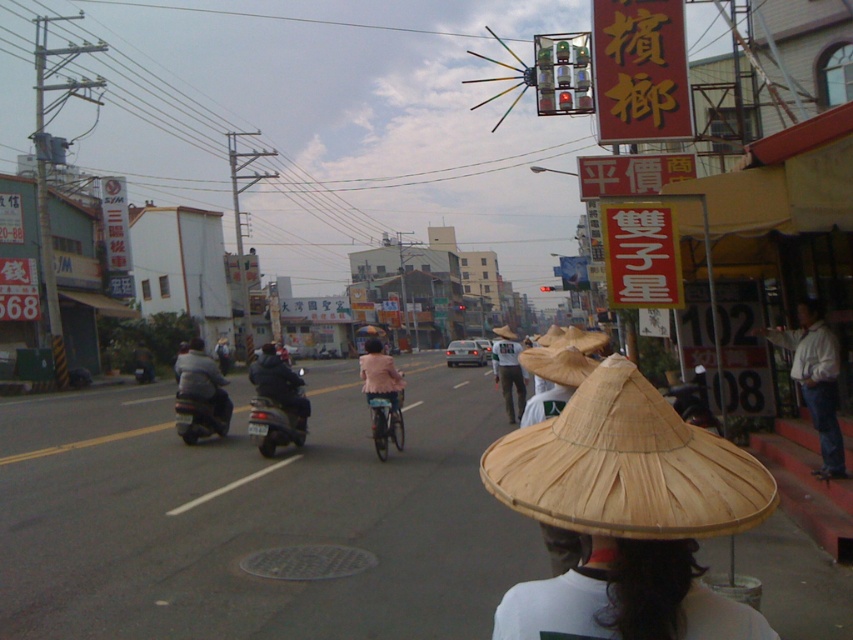
Question: Can you confirm if pink matte jacket at center is positioned below metallic silver motorcycle at center?

Choices:
 (A) no
 (B) yes

Answer: (A)

Question: Which point is farther to the camera?

Choices:
 (A) dark gray leather jacket at center-left
 (B) brown woven straw hat at center
 (C) bamboo straw hat at lower center
 (D) white straw hat at lower center

Answer: (A)

Question: Is the position of dark blue leather jacket at center more distant than that of dark gray leather jacket at center-left?

Choices:
 (A) yes
 (B) no

Answer: (B)

Question: Among these points, which one is farthest from the camera?

Choices:
 (A) (184, 356)
 (B) (590, 340)
 (C) (676, 588)
 (D) (639, 516)

Answer: (A)

Question: Does brown woven straw hat at center lie in front of pink matte jacket at center?

Choices:
 (A) yes
 (B) no

Answer: (A)

Question: Among these points, which one is farthest from the camera?

Choices:
 (A) (679, 625)
 (B) (514, 342)
 (C) (573, 362)
 (D) (840, 435)

Answer: (B)